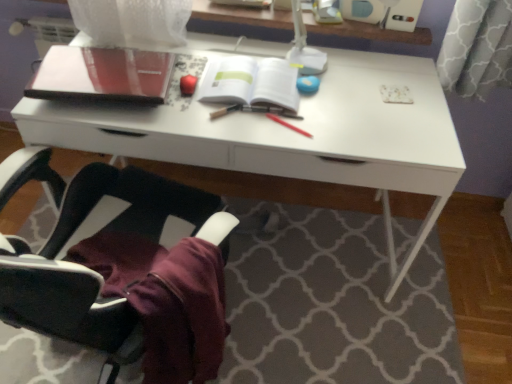
At what (x,y) coordinates should I click in order to perform the action: click on vacant area that lies between red matte pen at center, positioned as the 3th stationery in left-to-right order, and wooden pencil at center, the 2th stationery positioned from the left. Please return your answer as a coordinate pair (x, y). This screenshot has width=512, height=384. Looking at the image, I should click on [x=259, y=124].